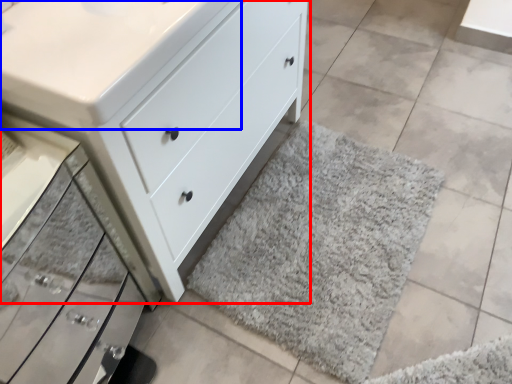
Question: Which object appears closest to the camera in this image, chest of drawers (highlighted by a red box) or counter top (highlighted by a blue box)?

Choices:
 (A) chest of drawers
 (B) counter top

Answer: (A)